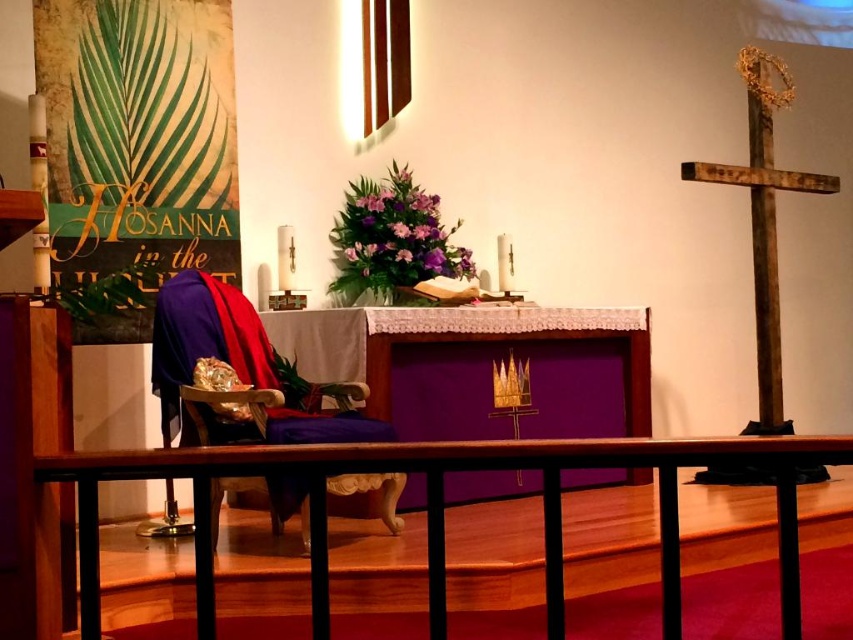
You are an architect designing a new church layout. You need to ensure that the brown wooden rail at lower center and the wooden cross at right are visible from the entrance. Given their sizes, which object might require placement adjustments to ensure visibility?

The brown wooden rail at lower center is smaller than the wooden cross at right, so the brown wooden rail at lower center might need to be placed in a more prominent position to ensure it is visible from the entrance.

You are standing at the entrance of the church and see the brown wooden rail at lower center and the purple velvet chair at center. Which object is positioned more to the right side of the church?

The brown wooden rail at lower center is positioned to the right of the purple velvet chair at center, so the brown wooden rail at lower center is more to the right.

You are a visitor entering the church and want to sit down. You see the brown wooden rail at lower center and the purple velvet chair at center. Which object is closer to the entrance?

The brown wooden rail at lower center is positioned under the purple velvet chair at center, meaning it is closer to the entrance than the chair.